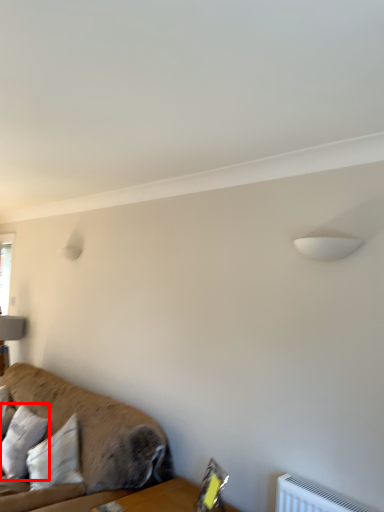
Question: Observing the image, what is the correct spatial positioning of pillow (annotated by the red box) in reference to studio couch?

Choices:
 (A) left
 (B) right

Answer: (A)